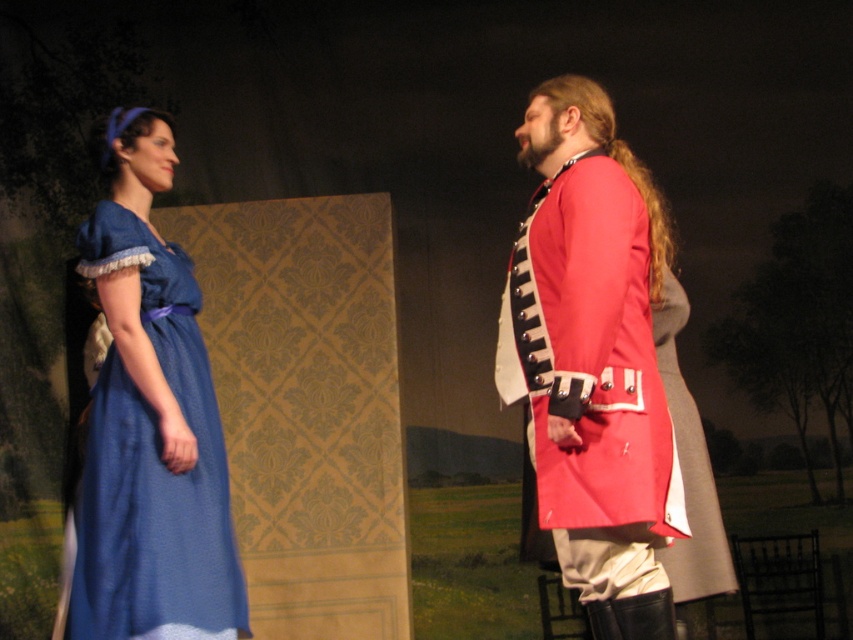
You are an audience member sitting in the front row of the theater. You notice the shiny red coat at center and the matte blue dress at left. Which costume appears nearer to you?

The shiny red coat at center appears nearer to you because it is closer to the viewer than the matte blue dress at left.

You are a costume designer preparing for a play. You have to decide which costume requires more fabric. Based on the image, which costume between the shiny red coat at center and the matte blue dress at left needs more fabric?

The shiny red coat at center is bigger than the matte blue dress at left, so it requires more fabric.

You are a photographer standing at the camera position. You want to take a photo of the point at coordinates point (637, 298). If your camera has a focal length of 50mm and you need to ensure the subject is in focus, what is the minimum distance you should set your focus ring to?

The point at coordinates point (637, 298) is 9.08 feet away from the camera. To ensure the subject is in focus, the focus ring should be set to at least 9.08 feet.